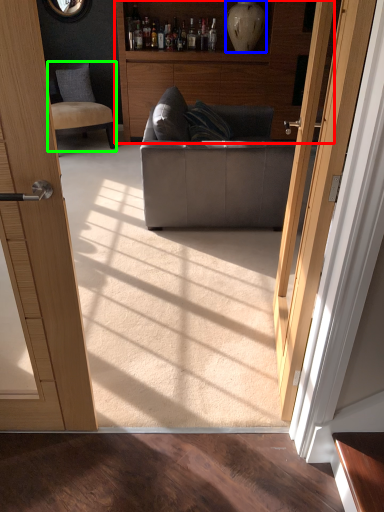
Question: Which object is the closest to the cabinetry (highlighted by a red box)? Choose among these: vase (highlighted by a blue box) or chair (highlighted by a green box).

Choices:
 (A) vase
 (B) chair

Answer: (A)